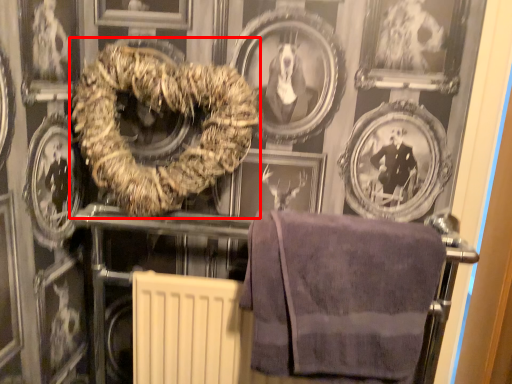
Question: From the image's perspective, where is towel (annotated by the red box) located in relation to towel in the image?

Choices:
 (A) above
 (B) below

Answer: (A)